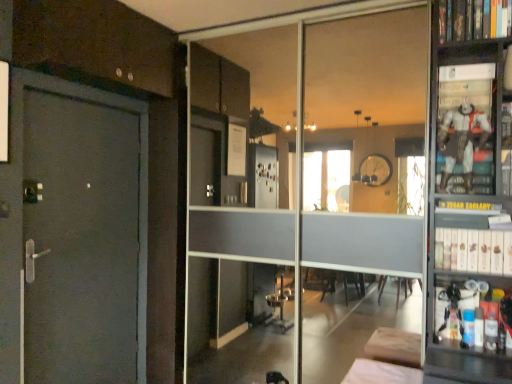
You are a GUI agent. You are given a task and a screenshot of the screen. Output one action in this format:
    pyautogui.click(x=<x>, y=<y>)
    Task: Click on the hardcover book at upper right, the 2th book ordered from the bottom
    
    Given the screenshot: What is the action you would take?
    pyautogui.click(x=474, y=19)

Is white fabric bed at lower center positioned before transparent glass door at center?

That is True.

Who is bigger, white fabric bed at lower center or transparent glass door at center?

Bigger between the two is transparent glass door at center.

From the image's perspective, which object appears higher, white fabric bed at lower center or transparent glass door at center?

transparent glass door at center is shown above in the image.

Can you confirm if white fabric bed at lower center is positioned to the right of transparent glass door at center?

Yes.

Is white fabric bed at lower center taller or shorter than hardcover book at upper right, the 2th book ordered from the bottom?

Clearly, white fabric bed at lower center is shorter compared to hardcover book at upper right, the 2th book ordered from the bottom.

Can you tell me how much white fabric bed at lower center and hardcover book at upper right, the 1th book positioned from the top, differ in facing direction?

They differ by 0.484 degrees in their facing directions.

Measure the distance between white fabric bed at lower center and hardcover book at upper right, the 2th book ordered from the bottom.

white fabric bed at lower center is 5.87 feet from hardcover book at upper right, the 2th book ordered from the bottom.

Is white fabric bed at lower center not inside hardcover book at upper right, the 2th book ordered from the bottom?

Yes, white fabric bed at lower center is outside of hardcover book at upper right, the 2th book ordered from the bottom.

Is metallic figure at right closer to camera compared to white matte bookshelf at right, which is counted as the 2th book, starting from the top?

No, the depth of metallic figure at right is greater than that of white matte bookshelf at right, which is counted as the 2th book, starting from the top.

Which point is more distant from viewer, (469, 163) or (503, 253)?

Positioned behind is point (469, 163).

From the image's perspective, is metallic figure at right above white matte bookshelf at right, which is counted as the 2th book, starting from the top?

Yes, from the image's perspective, metallic figure at right is over white matte bookshelf at right, which is counted as the 2th book, starting from the top.

Where is `book located on the left of white matte bookshelf at right, which is counted as the 2th book, starting from the top`? The width and height of the screenshot is (512, 384). book located on the left of white matte bookshelf at right, which is counted as the 2th book, starting from the top is located at coordinates tap(474, 19).

In the scene shown: Considering the relative sizes of hardcover book at upper right, the 1th book positioned from the top, and white matte bookshelf at right, which is counted as the 2th book, starting from the top, in the image provided, is hardcover book at upper right, the 1th book positioned from the top, bigger than white matte bookshelf at right, which is counted as the 2th book, starting from the top,?

Incorrect, hardcover book at upper right, the 1th book positioned from the top, is not larger than white matte bookshelf at right, which is counted as the 2th book, starting from the top.

From a real-world perspective, which is physically above, hardcover book at upper right, the 2th book ordered from the bottom, or white matte bookshelf at right, which is counted as the 2th book, starting from the top?

hardcover book at upper right, the 2th book ordered from the bottom, from a real-world perspective.

From the picture: Considering the sizes of objects hardcover book at upper right, the 1th book positioned from the top, and white matte bookshelf at right, which is counted as the 2th book, starting from the top, in the image provided, who is wider, hardcover book at upper right, the 1th book positioned from the top, or white matte bookshelf at right, which is counted as the 2th book, starting from the top,?

white matte bookshelf at right, which is counted as the 2th book, starting from the top.

From a real-world perspective, is white matte bookshelf at right, which is counted as the 1th book, starting from the bottom, above or below hardcover book at upper right, the 2th book ordered from the bottom?

Clearly, from a real-world perspective, white matte bookshelf at right, which is counted as the 1th book, starting from the bottom, is below hardcover book at upper right, the 2th book ordered from the bottom.

Does white matte bookshelf at right, which is counted as the 2th book, starting from the top, have a larger size compared to hardcover book at upper right, the 2th book ordered from the bottom?

Correct, white matte bookshelf at right, which is counted as the 2th book, starting from the top, is larger in size than hardcover book at upper right, the 2th book ordered from the bottom.

In terms of width, does white matte bookshelf at right, which is counted as the 2th book, starting from the top, look wider or thinner when compared to hardcover book at upper right, the 1th book positioned from the top?

Clearly, white matte bookshelf at right, which is counted as the 2th book, starting from the top, has more width compared to hardcover book at upper right, the 1th book positioned from the top.

Is white matte bookshelf at right, which is counted as the 2th book, starting from the top, situated inside hardcover book at upper right, the 1th book positioned from the top, or outside?

white matte bookshelf at right, which is counted as the 2th book, starting from the top, is not enclosed by hardcover book at upper right, the 1th book positioned from the top.

From a real-world perspective, does transparent glass door at center stand above white fabric bed at lower center?

Yes, from a real-world perspective, transparent glass door at center is above white fabric bed at lower center.

From the image's perspective, is transparent glass door at center under white fabric bed at lower center?

Incorrect, from the image's perspective, transparent glass door at center is higher than white fabric bed at lower center.

In terms of width, does transparent glass door at center look wider or thinner when compared to white fabric bed at lower center?

transparent glass door at center is thinner than white fabric bed at lower center.

Looking at this image, measure the distance from transparent glass door at center to white fabric bed at lower center.

16.02 feet.

Is point (392, 177) closer or farther from the camera than point (466, 254)?

Point (392, 177).

From a real-world perspective, is transparent glass door at center positioned under white matte bookshelf at right, which is counted as the 1th book, starting from the bottom, based on gravity?

No, from a real-world perspective, transparent glass door at center is not beneath white matte bookshelf at right, which is counted as the 1th book, starting from the bottom.

From the picture: How different are the orientations of transparent glass door at center and white matte bookshelf at right, which is counted as the 1th book, starting from the bottom, in degrees?

The facing directions of transparent glass door at center and white matte bookshelf at right, which is counted as the 1th book, starting from the bottom, are 1.99 degrees apart.

Is transparent glass door at center thinner than white matte bookshelf at right, which is counted as the 1th book, starting from the bottom?

Yes.

I want to click on furniture in front of the transparent glass door at center, so click(381, 373).

From the image's perspective, starting from the white fabric bed at lower center, which book is the 2nd one above? Please provide its 2D coordinates.

[(474, 19)]

Estimate the real-world distances between objects in this image. Which object is closer to hardcover book at upper right, the 1th book positioned from the top, metallic figure at right or white fabric bed at lower center?

Based on the image, metallic figure at right appears to be nearer to hardcover book at upper right, the 1th book positioned from the top.

Estimate the real-world distances between objects in this image. Which object is further from hardcover book at upper right, the 2th book ordered from the bottom, white matte bookshelf at right, which is counted as the 2th book, starting from the top, or transparent glass door at center?

transparent glass door at center is further to hardcover book at upper right, the 2th book ordered from the bottom.

Considering their positions, is transparent glass door at center positioned further to white matte bookshelf at right, which is counted as the 2th book, starting from the top, than metallic figure at right?

transparent glass door at center lies further to white matte bookshelf at right, which is counted as the 2th book, starting from the top, than the other object.

Based on their spatial positions, is metallic figure at right or white fabric bed at lower center further from transparent glass door at center?

Among the two, metallic figure at right is located further to transparent glass door at center.

In the scene shown: Looking at the image, which one is located further to hardcover book at upper right, the 1th book positioned from the top, transparent glass door at center or white matte bookshelf at right, which is counted as the 2th book, starting from the top?

transparent glass door at center lies further to hardcover book at upper right, the 1th book positioned from the top, than the other object.

From the image, which object appears to be nearer to white matte bookshelf at right, which is counted as the 1th book, starting from the bottom, transparent glass door at center or white fabric bed at lower center?

The object closer to white matte bookshelf at right, which is counted as the 1th book, starting from the bottom, is white fabric bed at lower center.

Estimate the real-world distances between objects in this image. Which object is closer to metallic figure at right, white fabric bed at lower center or hardcover book at upper right, the 1th book positioned from the top?

hardcover book at upper right, the 1th book positioned from the top.

From the image, which object appears to be nearer to transparent glass door at center, white fabric bed at lower center or hardcover book at upper right, the 1th book positioned from the top?

Among the two, white fabric bed at lower center is located nearer to transparent glass door at center.

Image resolution: width=512 pixels, height=384 pixels. In order to click on book between hardcover book at upper right, the 2th book ordered from the bottom, and white fabric bed at lower center from top to bottom in this screenshot , I will do `click(474, 250)`.

In order to click on book between transparent glass door at center and white fabric bed at lower center in the vertical direction in this screenshot , I will do `click(474, 250)`.

Where is `shelf between transparent glass door at center and white matte bookshelf at right, which is counted as the 1th book, starting from the bottom, in the horizontal direction`? The height and width of the screenshot is (384, 512). shelf between transparent glass door at center and white matte bookshelf at right, which is counted as the 1th book, starting from the bottom, in the horizontal direction is located at coordinates pyautogui.click(x=466, y=129).

The image size is (512, 384). I want to click on glass door that lies between hardcover book at upper right, the 1th book positioned from the top, and white matte bookshelf at right, which is counted as the 2th book, starting from the top, from top to bottom, so click(x=313, y=197).